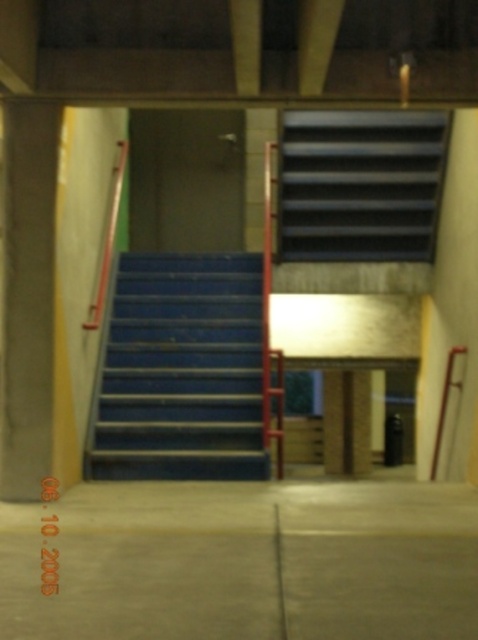
Question: Does blue painted metal stairs at center have a lesser width compared to metallic silver ladder at right?

Choices:
 (A) no
 (B) yes

Answer: (A)

Question: Estimate the real-world distances between objects in this image. Which object is closer to the blue rubber stairs at upper center?

Choices:
 (A) metallic silver ladder at right
 (B) blue painted metal stairs at center

Answer: (B)

Question: From the image, what is the correct spatial relationship of blue painted metal stairs at center in relation to metallic silver ladder at right?

Choices:
 (A) left
 (B) right

Answer: (A)

Question: Which point is farther from the camera taking this photo?

Choices:
 (A) (436, 435)
 (B) (332, 157)

Answer: (B)

Question: Estimate the real-world distances between objects in this image. Which object is farther from the metallic silver ladder at right?

Choices:
 (A) blue painted metal stairs at center
 (B) blue rubber stairs at upper center

Answer: (A)

Question: Does blue rubber stairs at upper center appear over metallic silver ladder at right?

Choices:
 (A) no
 (B) yes

Answer: (B)